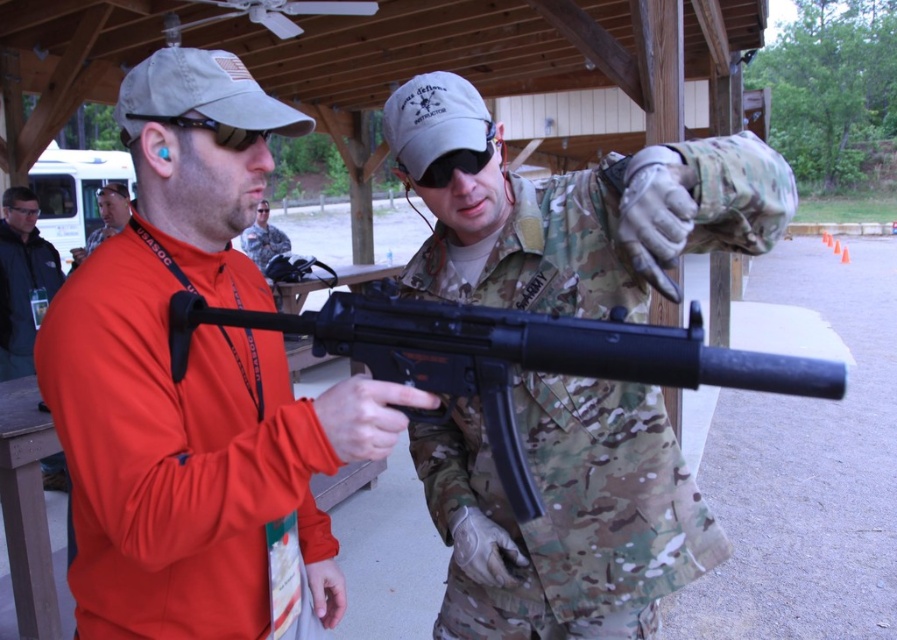
You are a safety officer at a shooting range. You need to ensure that the distance between the dark gray jacket at left and orange fabric shirt at left is at least 1 meter for safety. Based on the scene, is the current distance compliant with the safety requirement?

The dark gray jacket at left and orange fabric shirt at left are 93.33 centimeters apart from each other, which is less than the required 1 meter. Therefore, the current distance does not comply with the safety requirement.

You are a safety officer at a shooting range. You need to ensure that all firearms are properly stored in the secure locker after use. The black matte rifle at center is currently located at point [506,356]. Can you confirm if this rifle is within the designated storage area which is marked as the rectangle from point 0.5 to 0.6 in both x and y coordinates?

The black matte rifle at center is located at point [506,356]. The designated storage area is from 0.5 to 0.6 in both x and y coordinates. Since 0.559 and 0.565 fall within the 0.5 to 0.6 range, the rifle is within the designated storage area.

You are a safety officer at the training site. You notice two participants wearing dark gray jacket at left and orange fabric shirt at left. According to the safety protocol, the taller participant must stand behind the shorter one to avoid crossfire. Which participant should be positioned behind the other?

The dark gray jacket at left is taller than orange fabric shirt at left, so the dark gray jacket at left should stand behind orange fabric shirt at left to comply with safety protocols.